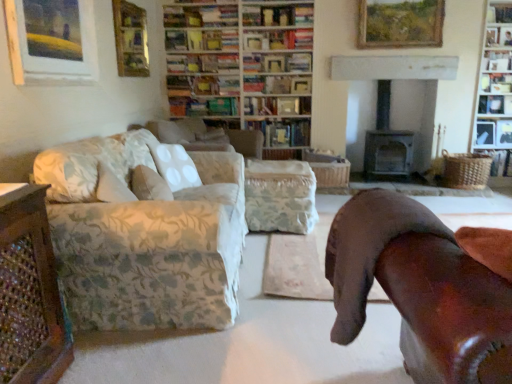
The width and height of the screenshot is (512, 384). I want to click on wooden picture frame at upper center, which is counted as the third picture frame, starting from the left, so click(x=400, y=23).

The height and width of the screenshot is (384, 512). What do you see at coordinates (495, 87) in the screenshot?
I see `white wooden bookcase at upper right, arranged as the first bookcase when viewed from the right` at bounding box center [495, 87].

Where is `woven brown basket at right, acting as the fifth book starting from the left`? The width and height of the screenshot is (512, 384). woven brown basket at right, acting as the fifth book starting from the left is located at coordinates (499, 161).

At what (x,y) coordinates should I click in order to perform the action: click on hardcover book at center, the 1th book viewed from the left. Please return your answer as a coordinate pair (x, y). Looking at the image, I should click on (203, 106).

Can you tell me how much wooden bookshelf at upper right, arranged as the first shelf when viewed from the top, and floral fabric couch at left differ in facing direction?

The angle between the facing direction of wooden bookshelf at upper right, arranged as the first shelf when viewed from the top, and the facing direction of floral fabric couch at left is 90.6 degrees.

Considering the sizes of objects wooden bookshelf at upper right, arranged as the first shelf when viewed from the top, and floral fabric couch at left in the image provided, who is wider, wooden bookshelf at upper right, arranged as the first shelf when viewed from the top, or floral fabric couch at left?

With larger width is floral fabric couch at left.

Is wooden bookshelf at upper right, which appears as the 3th shelf when ordered from the bottom, looking in the opposite direction of floral fabric couch at left?

No, floral fabric couch at left is not at the back of wooden bookshelf at upper right, which appears as the 3th shelf when ordered from the bottom.

Is floral fabric couch at left located within wooden bookshelf at upper right, which appears as the 3th shelf when ordered from the bottom?

No, floral fabric couch at left is not surrounded by wooden bookshelf at upper right, which appears as the 3th shelf when ordered from the bottom.

Which object is positioned more to the left, hardcover book at upper right, the second book from the right, or hardcover book at center, the third book when ordered from right to left?

Positioned to the left is hardcover book at center, the third book when ordered from right to left.

Considering the sizes of objects hardcover book at upper right, acting as the fourth book starting from the left, and hardcover book at center, the 3th book from the left, in the image provided, who is taller, hardcover book at upper right, acting as the fourth book starting from the left, or hardcover book at center, the 3th book from the left,?

With more height is hardcover book at center, the 3th book from the left.

From the image's perspective, is hardcover book at upper right, the second book from the right, positioned above or below hardcover book at center, the 3th book from the left?

hardcover book at upper right, the second book from the right, is situated higher than hardcover book at center, the 3th book from the left, in the image.

From the picture: Is hardcover book at center, the third book when ordered from right to left, at the back of hardcover book at upper right, the second book from the right?

No, hardcover book at upper right, the second book from the right,'s orientation is not away from hardcover book at center, the third book when ordered from right to left.

Is hardcover book at center, the third book when ordered from right to left, aimed at hardcover book at center, the 5th book viewed from the right?

No, hardcover book at center, the third book when ordered from right to left, does not turn towards hardcover book at center, the 5th book viewed from the right.

Is hardcover book at center, the 3th book from the left, wider or thinner than hardcover book at center, the 5th book viewed from the right?

hardcover book at center, the 3th book from the left, is wider than hardcover book at center, the 5th book viewed from the right.

Considering the sizes of objects hardcover book at center, the 3th book from the left, and hardcover book at center, the 5th book viewed from the right, in the image provided, who is smaller, hardcover book at center, the 3th book from the left, or hardcover book at center, the 5th book viewed from the right,?

hardcover book at center, the 5th book viewed from the right, is smaller.

Consider the image. Between hardcover book at center, the third book when ordered from right to left, and hardcover book at center, the 5th book viewed from the right, which one has less height?

hardcover book at center, the 5th book viewed from the right.

Between wooden shelf at upper right, the 3th shelf when ordered from top to bottom, and wooden bookshelf at upper center, arranged as the second bookcase when viewed from the right, which one has smaller width?

Thinner between the two is wooden shelf at upper right, the 3th shelf when ordered from top to bottom.

Find the location of `the 1st bookcase in front of the wooden shelf at upper right, the 1th shelf when ordered from bottom to top`. the 1st bookcase in front of the wooden shelf at upper right, the 1th shelf when ordered from bottom to top is located at coordinates (243, 67).

Based on the photo, is wooden shelf at upper right, the 1th shelf when ordered from bottom to top, smaller than wooden bookshelf at upper center, which appears as the first bookcase when viewed from the left?

Correct, wooden shelf at upper right, the 1th shelf when ordered from bottom to top, occupies less space than wooden bookshelf at upper center, which appears as the first bookcase when viewed from the left.

Considering the positions of point (486, 138) and point (487, 105), is point (486, 138) closer or farther from the camera than point (487, 105)?

Point (486, 138).

Looking at this image, from a real-world perspective, is wooden picture frame at upper right, acting as the fourth picture frame starting from the front, positioned under hardcover book at upper right, the second book from the right, based on gravity?

Yes, from a real-world perspective, wooden picture frame at upper right, acting as the fourth picture frame starting from the front, is below hardcover book at upper right, the second book from the right.

Can you confirm if wooden picture frame at upper right, which is counted as the fourth picture frame, starting from the left, is taller than hardcover book at upper right, acting as the fourth book starting from the left?

Yes, wooden picture frame at upper right, which is counted as the fourth picture frame, starting from the left, is taller than hardcover book at upper right, acting as the fourth book starting from the left.

Which object is further away from the camera, wooden picture frame at upper right, which is counted as the first picture frame, starting from the back, or hardcover book at upper right, the second book from the right?

hardcover book at upper right, the second book from the right, is more distant.

Based on their positions, is floral fabric couch at left located to the left or right of wooden bookshelf at upper center, arranged as the second bookcase when viewed from the right?

floral fabric couch at left is positioned on wooden bookshelf at upper center, arranged as the second bookcase when viewed from the right,'s left side.

From the picture: How far apart are floral fabric couch at left and wooden bookshelf at upper center, which appears as the first bookcase when viewed from the left?

floral fabric couch at left is 10.00 feet from wooden bookshelf at upper center, which appears as the first bookcase when viewed from the left.

Which point is more forward, (54,153) or (172,12)?

The point (54,153) is closer to the camera.

Is the depth of floral fabric couch at left greater than that of wooden bookshelf at upper center, arranged as the second bookcase when viewed from the right?

No, it is not.

Would you consider wooden shelf at upper right, placed as the 2th shelf when sorted from bottom to top, to be distant from hardcover book at center, acting as the fourth book starting from the right?

That's right, there is a large distance between wooden shelf at upper right, placed as the 2th shelf when sorted from bottom to top, and hardcover book at center, acting as the fourth book starting from the right.

Based on the photo, is the position of wooden shelf at upper right, the 2th shelf positioned from the top, more distant than that of hardcover book at center, acting as the fourth book starting from the right?

No, wooden shelf at upper right, the 2th shelf positioned from the top, is in front of hardcover book at center, acting as the fourth book starting from the right.

Considering the sizes of wooden shelf at upper right, the 2th shelf positioned from the top, and hardcover book at center, acting as the fourth book starting from the right, in the image, is wooden shelf at upper right, the 2th shelf positioned from the top, wider or thinner than hardcover book at center, acting as the fourth book starting from the right,?

wooden shelf at upper right, the 2th shelf positioned from the top, is thinner than hardcover book at center, acting as the fourth book starting from the right.

Locate an element on the screen. This screenshot has width=512, height=384. the 1st shelf counting from the right of the floral fabric couch at left is located at coordinates (499, 12).

Locate an element on the screen. The height and width of the screenshot is (384, 512). book that is the 2nd one when counting forward from the hardcover book at center, the third book when ordered from right to left is located at coordinates (495, 104).

Which object lies nearer to the anchor point woven brown basket at right, the first book from the right, white wooden bookcase at upper right, the second bookcase in the left-to-right sequence, or wooden picture frame at upper center, marked as the 2th picture frame in a back-to-front arrangement?

Among the two, white wooden bookcase at upper right, the second bookcase in the left-to-right sequence, is located nearer to woven brown basket at right, the first book from the right.

Based on their spatial positions, is wooden bookshelf at upper right, arranged as the first shelf when viewed from the top, or wooden picture frame at upper center, marked as the 2th picture frame in a back-to-front arrangement, further from white wooden bookcase at upper right, the second bookcase in the left-to-right sequence?

The object further to white wooden bookcase at upper right, the second bookcase in the left-to-right sequence, is wooden picture frame at upper center, marked as the 2th picture frame in a back-to-front arrangement.

From the picture: Looking at the image, which one is located further to floral fabric couch at left, wooden bookshelf at upper right, arranged as the first shelf when viewed from the top, or wooden picture frame at upper left, arranged as the second picture frame when viewed from the left?

Among the two, wooden bookshelf at upper right, arranged as the first shelf when viewed from the top, is located further to floral fabric couch at left.

When comparing their distances from hardcover book at center, acting as the fourth book starting from the right, does wooden bookshelf at upper right, which appears as the 3th shelf when ordered from the bottom, or white wooden bookcase at upper right, the second bookcase in the left-to-right sequence, seem further?

wooden bookshelf at upper right, which appears as the 3th shelf when ordered from the bottom.

Estimate the real-world distances between objects in this image. Which object is closer to wooden picture frame at upper right, arranged as the first picture frame when viewed from the right, white wooden bookcase at upper right, the second bookcase in the left-to-right sequence, or brown leather chair at right?

The object closer to wooden picture frame at upper right, arranged as the first picture frame when viewed from the right, is white wooden bookcase at upper right, the second bookcase in the left-to-right sequence.

When comparing their distances from white wooden bookcase at upper right, the second bookcase in the left-to-right sequence, does brown leather chair at right or wooden picture frame at upper center, the 2th picture frame from the right, seem further?

Based on the image, brown leather chair at right appears to be further to white wooden bookcase at upper right, the second bookcase in the left-to-right sequence.

When comparing their distances from hardcover book at upper right, acting as the fourth book starting from the left, does hardcover book at center, the 3th book from the left, or wooden picture frame at upper center, which is counted as the third picture frame, starting from the left, seem further?

Among the two, hardcover book at center, the 3th book from the left, is located further to hardcover book at upper right, acting as the fourth book starting from the left.

Estimate the real-world distances between objects in this image. Which object is further from hardcover book at center, which appears as the second book when viewed from the left, wooden picture frame at upper right, which is counted as the fourth picture frame, starting from the left, or woven brown basket at right, acting as the fifth book starting from the left?

woven brown basket at right, acting as the fifth book starting from the left.

In order to click on shelf located between wooden picture frame at upper left, the fourth picture frame from the back, and wooden shelf at upper right, the 2th shelf positioned from the top, in the left-right direction in this screenshot , I will do `click(499, 12)`.

Find the location of a particular element. shelf situated between floral fabric pillow at center and hardcover book at upper right, the second book from the right, from left to right is located at coordinates pos(499,12).

This screenshot has height=384, width=512. What are the coordinates of `pillow between wooden picture frame at upper left, the 3th picture frame viewed from the right, and white wooden bookcase at upper right, arranged as the first bookcase when viewed from the right` in the screenshot? It's located at (149, 184).

Find the location of a particular element. book between hardcover book at center, which appears as the second book when viewed from the left, and wooden picture frame at upper center, which is counted as the third picture frame, starting from the left is located at coordinates (283, 132).